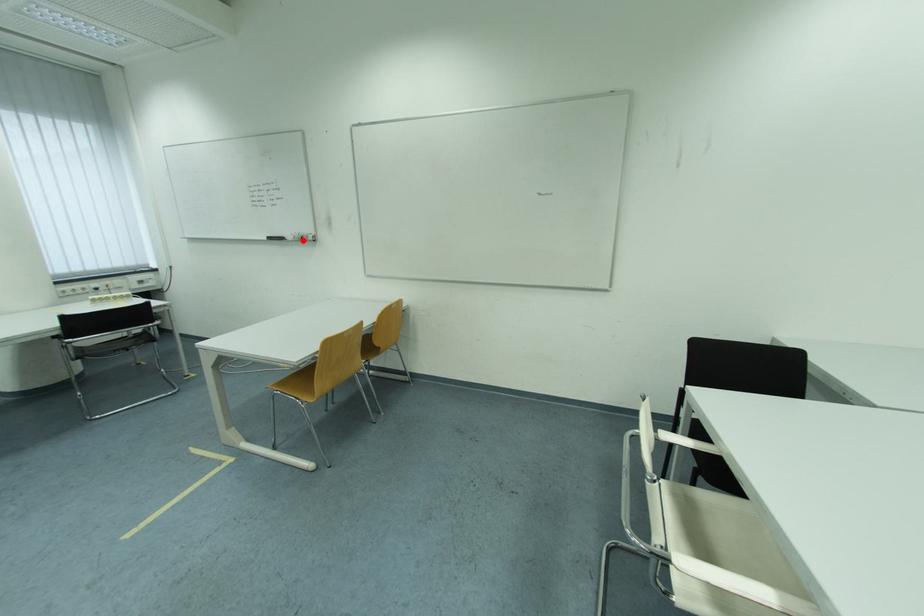
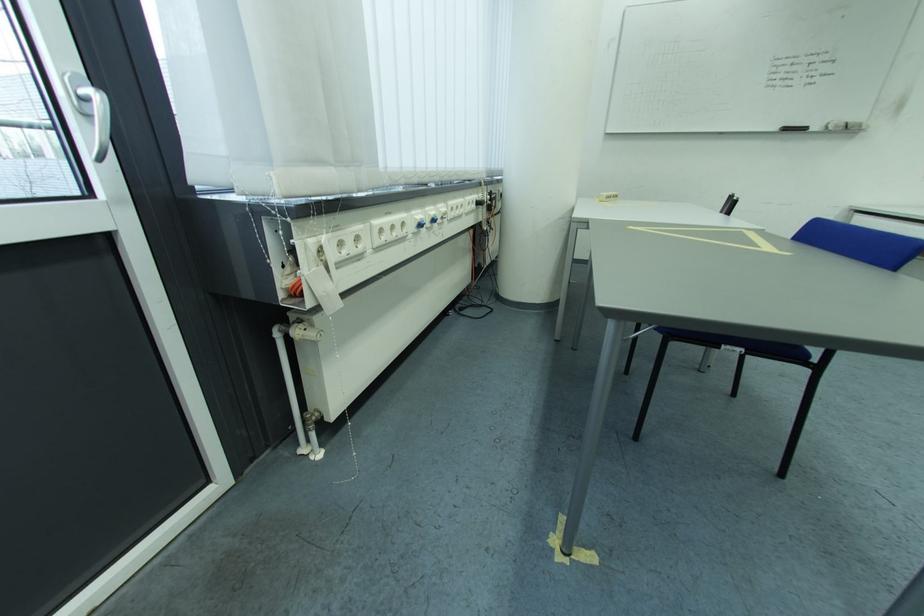
Where in the second image is the point corresponding to the highlighted location from the first image?

(845, 129)